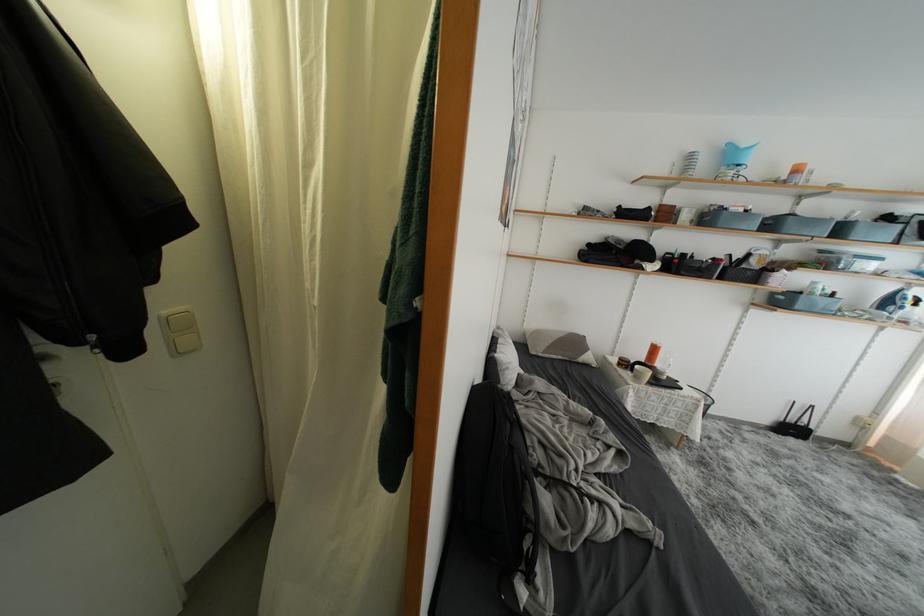
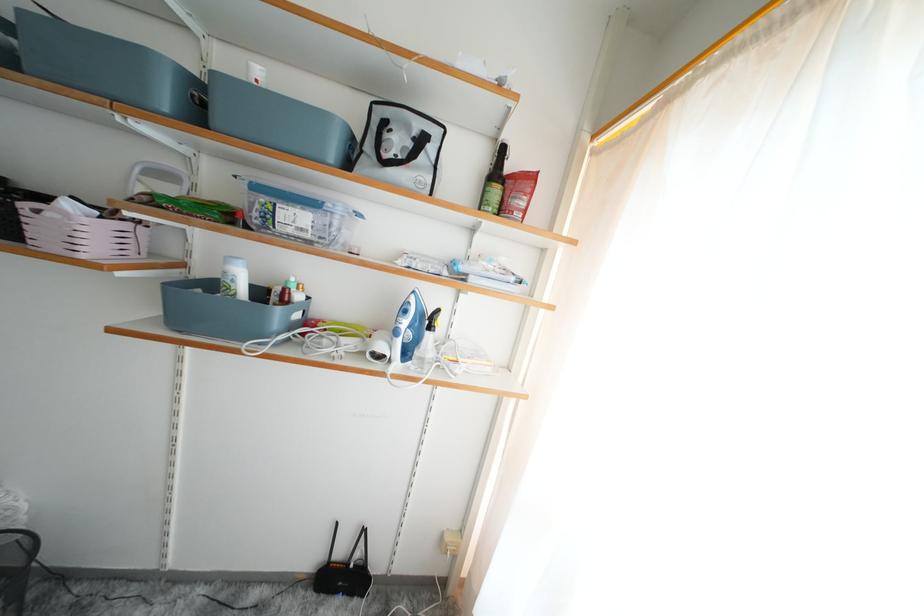
Question: The images are taken continuously from a first-person perspective. In which direction are you moving?

Choices:
 (A) Left
 (B) Right
 (C) Forward
 (D) Backward

Answer: (B)